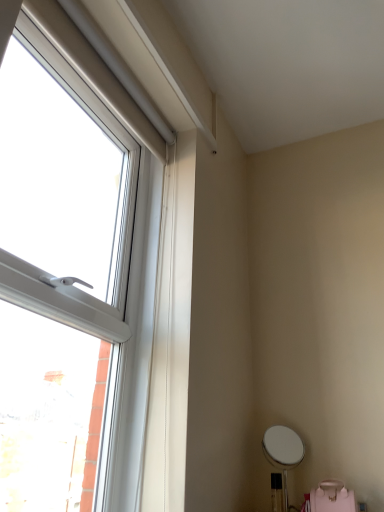
Question: Is pink matte swivel chair at lower right to the right of transparent plastic window at left from the viewer's perspective?

Choices:
 (A) yes
 (B) no

Answer: (A)

Question: Is pink matte swivel chair at lower right in contact with transparent plastic window at left?

Choices:
 (A) yes
 (B) no

Answer: (B)

Question: Does pink matte swivel chair at lower right come behind transparent plastic window at left?

Choices:
 (A) no
 (B) yes

Answer: (B)

Question: Considering the relative sizes of pink matte swivel chair at lower right and transparent plastic window at left in the image provided, is pink matte swivel chair at lower right smaller than transparent plastic window at left?

Choices:
 (A) yes
 (B) no

Answer: (A)

Question: Is pink matte swivel chair at lower right facing towards transparent plastic window at left?

Choices:
 (A) yes
 (B) no

Answer: (B)

Question: Can you confirm if pink matte swivel chair at lower right is thinner than transparent plastic window at left?

Choices:
 (A) no
 (B) yes

Answer: (A)

Question: Is transparent plastic window at left at the left side of pink matte swivel chair at lower right?

Choices:
 (A) no
 (B) yes

Answer: (B)

Question: Is the depth of transparent plastic window at left greater than that of pink matte swivel chair at lower right?

Choices:
 (A) no
 (B) yes

Answer: (A)

Question: Is transparent plastic window at left positioned before pink matte swivel chair at lower right?

Choices:
 (A) no
 (B) yes

Answer: (B)

Question: From a real-world perspective, is transparent plastic window at left over pink matte swivel chair at lower right?

Choices:
 (A) yes
 (B) no

Answer: (A)

Question: Is transparent plastic window at left surrounding pink matte swivel chair at lower right?

Choices:
 (A) yes
 (B) no

Answer: (B)

Question: Is transparent plastic window at left oriented away from pink matte swivel chair at lower right?

Choices:
 (A) yes
 (B) no

Answer: (B)

Question: Based on their positions, is pink matte swivel chair at lower right located to the left or right of transparent plastic window at left?

Choices:
 (A) left
 (B) right

Answer: (B)